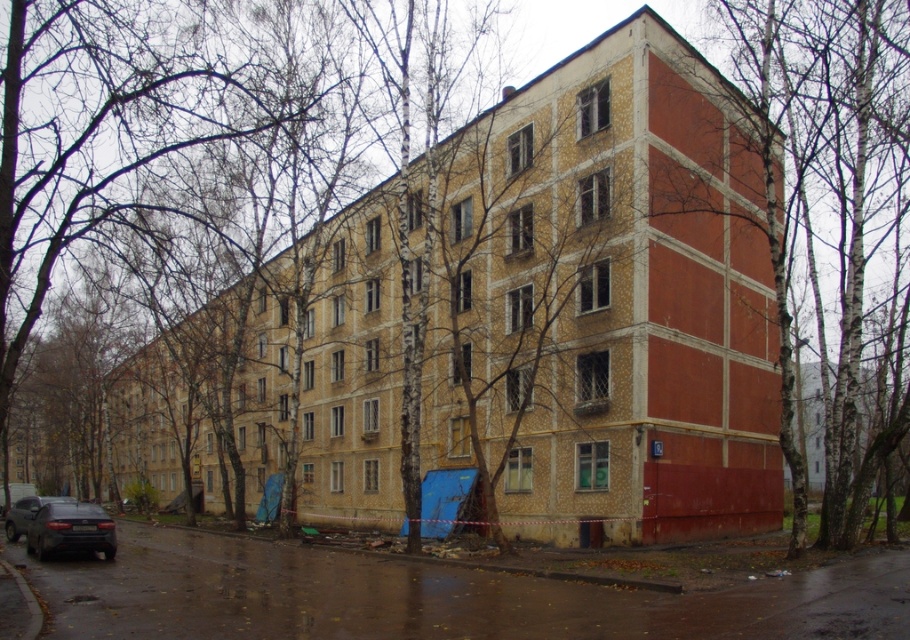
Question: Which of the following is the farthest from the observer?

Choices:
 (A) (67, 550)
 (B) (51, 500)
 (C) (833, 234)

Answer: (C)

Question: Is dark gray metallic car at lower left bigger than shiny black car at lower left?

Choices:
 (A) yes
 (B) no

Answer: (B)

Question: Can you confirm if dark gray metallic car at lower left is positioned below shiny black car at lower left?

Choices:
 (A) yes
 (B) no

Answer: (B)

Question: Is smooth bark tree at center bigger than dark gray metallic car at lower left?

Choices:
 (A) yes
 (B) no

Answer: (A)

Question: Which of the following is the farthest from the observer?

Choices:
 (A) (843, 182)
 (B) (63, 496)
 (C) (36, 538)

Answer: (B)

Question: Which object is the closest to the smooth bark tree at center?

Choices:
 (A) shiny black car at lower left
 (B) dark gray metallic car at lower left

Answer: (B)